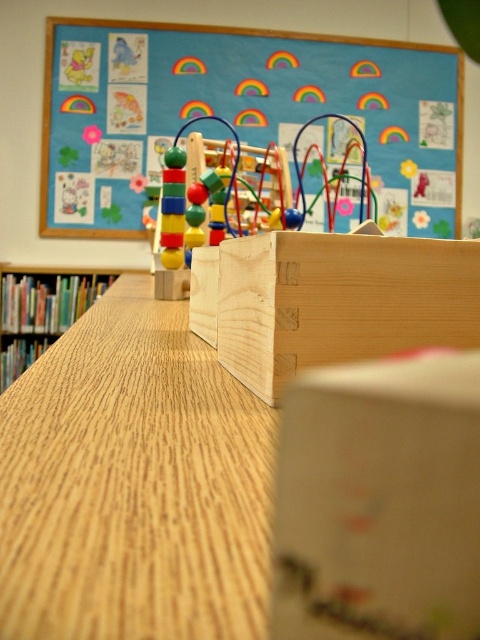
Question: Which point appears closest to the camera in this image?

Choices:
 (A) (192, 218)
 (B) (240, 138)
 (C) (245, 356)

Answer: (C)

Question: Considering the relative positions of wooden table at center and matte wooden board at upper center in the image provided, where is wooden table at center located with respect to matte wooden board at upper center?

Choices:
 (A) above
 (B) below

Answer: (B)

Question: Which point is closer to the camera?

Choices:
 (A) white matte box at center
 (B) matte wooden board at upper center

Answer: (A)

Question: Which point is closer to the camera?

Choices:
 (A) multicolored wooden beads at center
 (B) wooden bookshelf at left

Answer: (A)

Question: Considering the relative positions of wooden table at center and white matte box at center in the image provided, where is wooden table at center located with respect to white matte box at center?

Choices:
 (A) above
 (B) below

Answer: (A)

Question: Can you confirm if natural wood box at center is positioned below multicolored wooden beads at center?

Choices:
 (A) no
 (B) yes

Answer: (B)